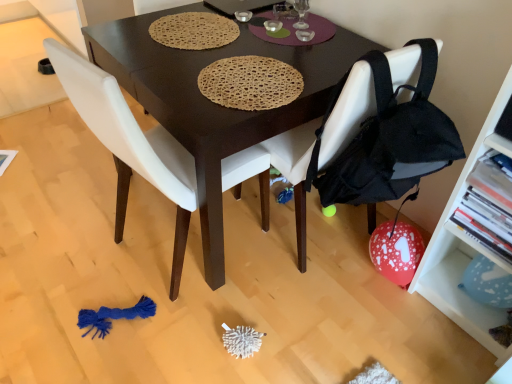
Identify the location of free spot in front of dark brown wood desk at center. (237, 322).